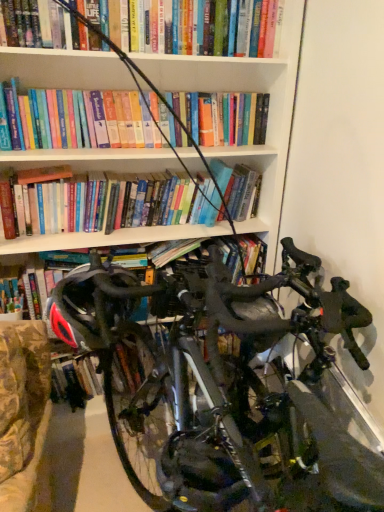
Question: Considering the relative positions of shiny black bicycle at center and black matte helmet at center in the image provided, is shiny black bicycle at center behind black matte helmet at center?

Choices:
 (A) no
 (B) yes

Answer: (A)

Question: From a real-world perspective, is shiny black bicycle at center located beneath black matte helmet at center?

Choices:
 (A) yes
 (B) no

Answer: (A)

Question: Does shiny black bicycle at center have a greater height compared to black matte helmet at center?

Choices:
 (A) yes
 (B) no

Answer: (A)

Question: Considering the relative sizes of shiny black bicycle at center and black matte helmet at center in the image provided, is shiny black bicycle at center bigger than black matte helmet at center?

Choices:
 (A) no
 (B) yes

Answer: (B)

Question: Could you tell me if shiny black bicycle at center is turned towards black matte helmet at center?

Choices:
 (A) yes
 (B) no

Answer: (A)

Question: From a real-world perspective, is shiny black bicycle at center on top of black matte helmet at center?

Choices:
 (A) no
 (B) yes

Answer: (A)

Question: Considering the relative sizes of black matte helmet at center and shiny black bicycle at center in the image provided, is black matte helmet at center wider than shiny black bicycle at center?

Choices:
 (A) no
 (B) yes

Answer: (A)

Question: Can you confirm if black matte helmet at center is positioned to the right of shiny black bicycle at center?

Choices:
 (A) no
 (B) yes

Answer: (A)

Question: Considering the relative sizes of black matte helmet at center and shiny black bicycle at center in the image provided, is black matte helmet at center bigger than shiny black bicycle at center?

Choices:
 (A) yes
 (B) no

Answer: (B)

Question: Is black matte helmet at center looking in the opposite direction of shiny black bicycle at center?

Choices:
 (A) no
 (B) yes

Answer: (B)

Question: Is black matte helmet at center shorter than shiny black bicycle at center?

Choices:
 (A) yes
 (B) no

Answer: (A)

Question: Does black matte helmet at center appear on the left side of shiny black bicycle at center?

Choices:
 (A) yes
 (B) no

Answer: (A)

Question: Is shiny black bicycle at center to the left or to the right of black matte helmet at center in the image?

Choices:
 (A) right
 (B) left

Answer: (A)